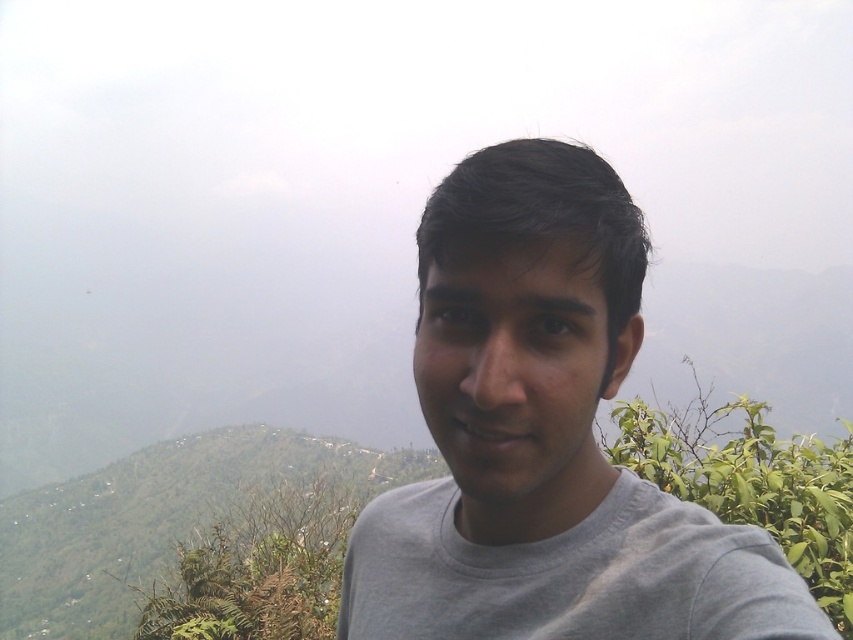
You are a photographer trying to capture the person in the scene. The person is standing at the center wearing a gray cotton t shirt. There is a point at coordinates (570, 573). Where exactly is this point located on the person?

The point at coordinates (570, 573) is located on the gray cotton t shirt at center.